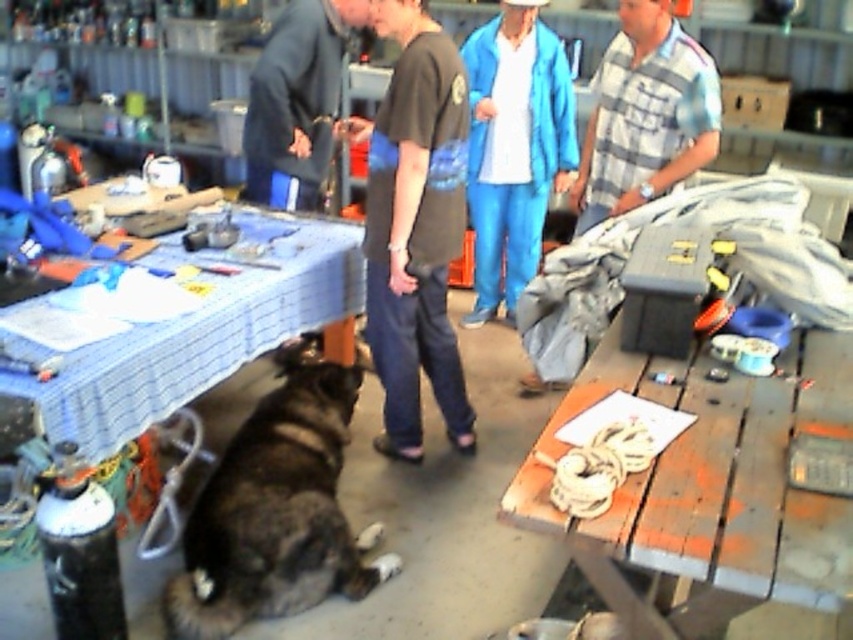
Consider the image. Does wooden table at lower right have a lesser height compared to dark brown fur dog at lower left?

Yes.

Is wooden table at lower right above dark brown fur dog at lower left?

Yes.

Who is more forward, [685,529] or [323,372]?

Point [685,529]

This screenshot has height=640, width=853. What are the coordinates of `wooden table at lower right` in the screenshot? It's located at (709, 486).

Between dark brown fur dog at lower left and plaid cotton shirt at upper right, which one appears on the left side from the viewer's perspective?

From the viewer's perspective, dark brown fur dog at lower left appears more on the left side.

Between point (218, 488) and point (593, 136), which one is positioned behind?

Positioned behind is point (593, 136).

Identify the location of dark brown fur dog at lower left. (276, 512).

Is plaid cotton shirt at upper right above dark blue fabric at center?

No, plaid cotton shirt at upper right is not above dark blue fabric at center.

Looking at this image, who is taller, plaid cotton shirt at upper right or dark blue fabric at center?

With more height is plaid cotton shirt at upper right.

Image resolution: width=853 pixels, height=640 pixels. What are the coordinates of `plaid cotton shirt at upper right` in the screenshot? It's located at (645, 115).

The height and width of the screenshot is (640, 853). In order to click on plaid cotton shirt at upper right in this screenshot , I will do `click(645, 115)`.